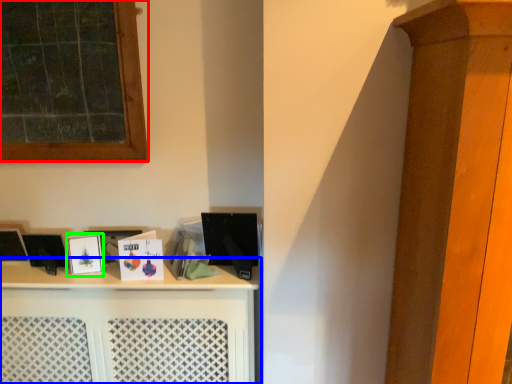
Question: Which is nearer to the window (highlighted by a red box)? shelf (highlighted by a blue box) or picture frame (highlighted by a green box).

Choices:
 (A) shelf
 (B) picture frame

Answer: (B)